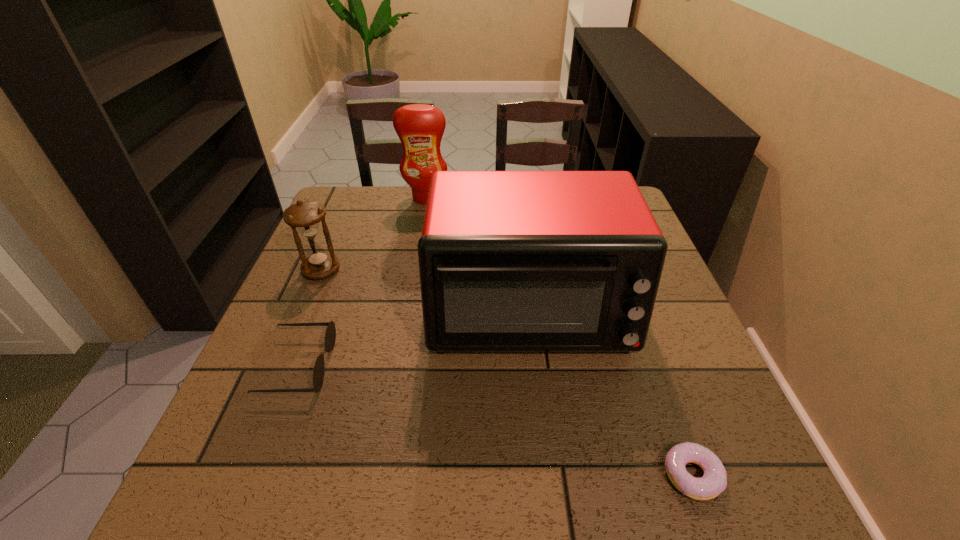
Choose which object is the nearest neighbor to the sunglasses. Please provide its 2D coordinates. Your answer should be formatted as a tuple, i.e. [(x, y)], where the tuple contains the x and y coordinates of a point satisfying the conditions above.

[(305, 216)]

The width and height of the screenshot is (960, 540). What are the coordinates of `object that can be found as the third closest to the hourglass` in the screenshot? It's located at (420, 127).

You are a GUI agent. You are given a task and a screenshot of the screen. Output one action in this format:
    pyautogui.click(x=<x>, y=<y>)
    Task: Click on the vacant area that satisfies the following two spatial constraints: 1. on the front-facing side of the nearest object; 2. on the right side of the toaster oven
    
    Given the screenshot: What is the action you would take?
    pyautogui.click(x=547, y=475)

This screenshot has width=960, height=540. What are the coordinates of `free space that satisfies the following two spatial constraints: 1. on the label side of the farthest object; 2. on the right side of the doughnut` in the screenshot? It's located at (377, 475).

Image resolution: width=960 pixels, height=540 pixels. Identify the location of vacant region that satisfies the following two spatial constraints: 1. on the front-facing side of the fourth tallest object; 2. on the left side of the nearest object. (256, 475).

Where is `vacant area that satisfies the following two spatial constraints: 1. on the front-facing side of the second shortest object; 2. on the right side of the shortest object`? vacant area that satisfies the following two spatial constraints: 1. on the front-facing side of the second shortest object; 2. on the right side of the shortest object is located at coordinates (256, 475).